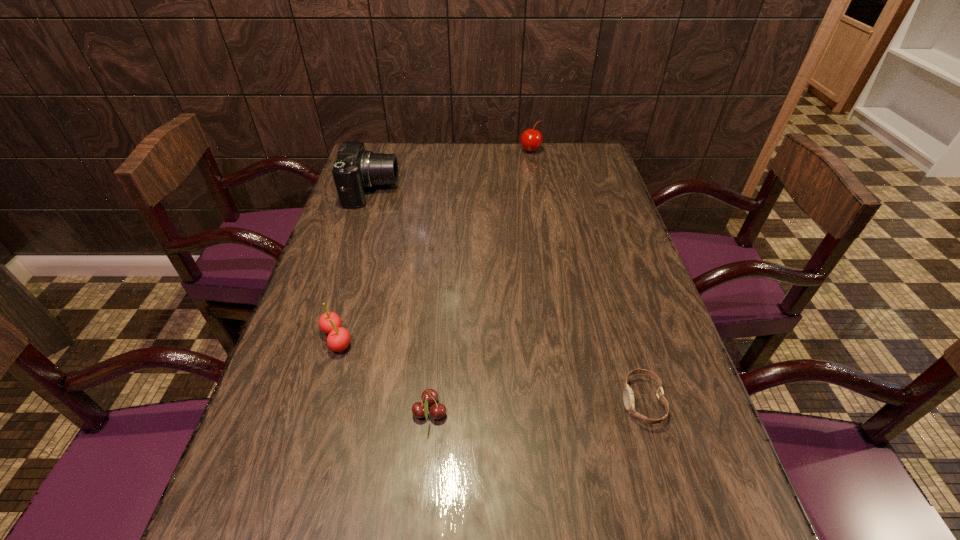
Locate an element on the screen. The image size is (960, 540). the second farthest object is located at coordinates (355, 169).

Find the location of a particular element. the tallest object is located at coordinates point(355,169).

At what (x,y) coordinates should I click in order to perform the action: click on the farthest object. Please return your answer as a coordinate pair (x, y). Looking at the image, I should click on (531, 139).

Locate an element on the screen. the rightmost cherry is located at coordinates (531, 139).

Identify the location of the third farthest object. This screenshot has width=960, height=540. (338, 339).

Find the location of `the second shortest cherry`. the second shortest cherry is located at coordinates pyautogui.click(x=338, y=339).

Locate an element on the screen. the shortest cherry is located at coordinates (429, 396).

Image resolution: width=960 pixels, height=540 pixels. I want to click on the nearest cherry, so click(x=429, y=396).

Identify the location of the shortest object. This screenshot has width=960, height=540. 628,397.

Locate an element on the screen. The height and width of the screenshot is (540, 960). watch is located at coordinates (628, 397).